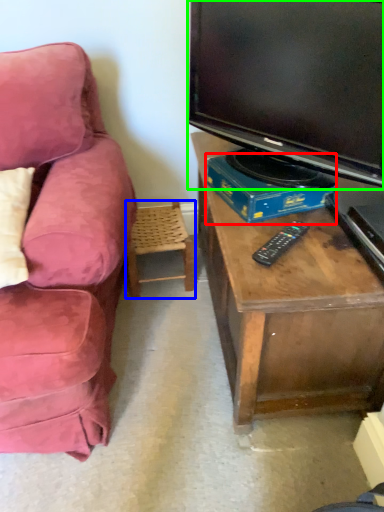
Question: Which object is the closest to the book (highlighted by a red box)? Choose among these: chair (highlighted by a blue box) or television (highlighted by a green box).

Choices:
 (A) chair
 (B) television

Answer: (B)